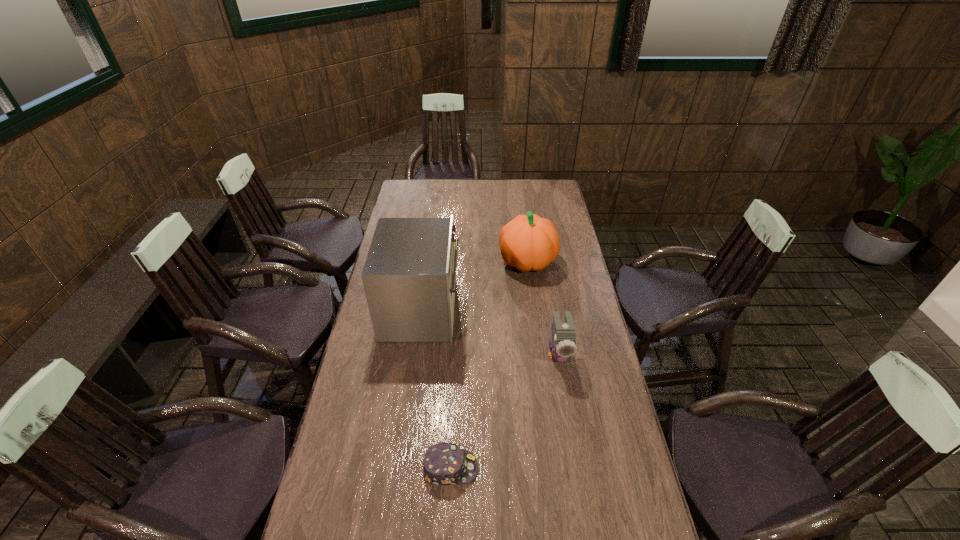
Locate an element on the screen. toaster oven is located at coordinates (409, 276).

This screenshot has height=540, width=960. Find the location of `the farthest object`. the farthest object is located at coordinates (528, 242).

This screenshot has width=960, height=540. Identify the location of the second tallest object. (528, 242).

At what (x,y) coordinates should I click in order to perform the action: click on bird. Please return your answer as a coordinate pair (x, y). Looking at the image, I should click on (563, 345).

Locate an element on the screen. This screenshot has width=960, height=540. headwear is located at coordinates (444, 463).

You are a GUI agent. You are given a task and a screenshot of the screen. Output one action in this format:
    pyautogui.click(x=<x>, y=<y>)
    Task: Click on the nearest object
    
    Given the screenshot: What is the action you would take?
    pyautogui.click(x=444, y=463)

This screenshot has width=960, height=540. I want to click on free point located on the front panel of the toaster oven, so (x=516, y=310).

Find the location of a particular element. The image size is (960, 540). free space located 0.300m on the front of the third shortest object is located at coordinates (537, 333).

Locate an element on the screen. vacant area located 0.160m at the beak of the third tallest object is located at coordinates (569, 416).

Where is `blank space located 0.180m on the front-facing side of the shortest object`? The height and width of the screenshot is (540, 960). blank space located 0.180m on the front-facing side of the shortest object is located at coordinates (539, 468).